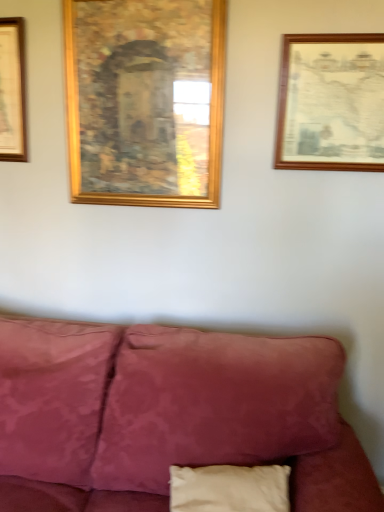
Question: Considering the relative sizes of gold wooden picture frame at upper center, the second picture frame in the right-to-left sequence, and wooden picture frame at upper right, which is counted as the 2th picture frame, starting from the left, in the image provided, is gold wooden picture frame at upper center, the second picture frame in the right-to-left sequence, smaller than wooden picture frame at upper right, which is counted as the 2th picture frame, starting from the left,?

Choices:
 (A) no
 (B) yes

Answer: (A)

Question: Considering the relative positions of gold wooden picture frame at upper center, the second picture frame in the right-to-left sequence, and wooden picture frame at upper right, which is counted as the 2th picture frame, starting from the left, in the image provided, is gold wooden picture frame at upper center, the second picture frame in the right-to-left sequence, to the right of wooden picture frame at upper right, which is counted as the 2th picture frame, starting from the left, from the viewer's perspective?

Choices:
 (A) no
 (B) yes

Answer: (A)

Question: Does gold wooden picture frame at upper center, which is the first picture frame in left-to-right order, appear on the left side of wooden picture frame at upper right, which is the first picture frame from right to left?

Choices:
 (A) no
 (B) yes

Answer: (B)

Question: Does gold wooden picture frame at upper center, the second picture frame in the right-to-left sequence, have a lesser width compared to wooden picture frame at upper right, which is the first picture frame from right to left?

Choices:
 (A) yes
 (B) no

Answer: (B)

Question: Is gold wooden picture frame at upper center, the second picture frame in the right-to-left sequence, in front of wooden picture frame at upper right, which is the first picture frame from right to left?

Choices:
 (A) no
 (B) yes

Answer: (A)

Question: From the image's perspective, does gold wooden picture frame at upper center, which is the first picture frame in left-to-right order, appear higher than wooden picture frame at upper right, which is the first picture frame from right to left?

Choices:
 (A) yes
 (B) no

Answer: (A)

Question: From a real-world perspective, is wooden picture frame at upper right, which is counted as the 2th picture frame, starting from the left, beneath gold wooden picture frame at upper center, which is the first picture frame in left-to-right order?

Choices:
 (A) no
 (B) yes

Answer: (B)

Question: Can you confirm if wooden picture frame at upper right, which is the first picture frame from right to left, is positioned to the right of gold wooden picture frame at upper center, the second picture frame in the right-to-left sequence?

Choices:
 (A) no
 (B) yes

Answer: (B)

Question: Is wooden picture frame at upper right, which is counted as the 2th picture frame, starting from the left, wider than gold wooden picture frame at upper center, the second picture frame in the right-to-left sequence?

Choices:
 (A) yes
 (B) no

Answer: (B)

Question: Would you say wooden picture frame at upper right, which is the first picture frame from right to left, is outside gold wooden picture frame at upper center, which is the first picture frame in left-to-right order?

Choices:
 (A) yes
 (B) no

Answer: (A)

Question: Is wooden picture frame at upper right, which is counted as the 2th picture frame, starting from the left, thinner than gold wooden picture frame at upper center, the second picture frame in the right-to-left sequence?

Choices:
 (A) yes
 (B) no

Answer: (A)

Question: From the image's perspective, is wooden picture frame at upper right, which is the first picture frame from right to left, below gold wooden picture frame at upper center, which is the first picture frame in left-to-right order?

Choices:
 (A) no
 (B) yes

Answer: (B)

Question: Does point (117, 133) appear closer or farther from the camera than point (276, 167)?

Choices:
 (A) farther
 (B) closer

Answer: (A)